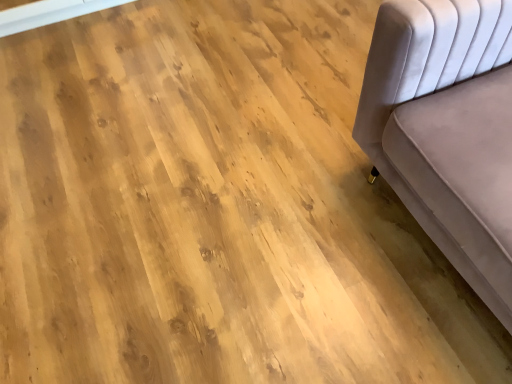
This screenshot has width=512, height=384. In order to click on suede-like gray couch at right in this screenshot , I will do `click(447, 131)`.

Describe the element at coordinates (447, 131) in the screenshot. The image size is (512, 384). I see `suede-like gray couch at right` at that location.

You are a GUI agent. You are given a task and a screenshot of the screen. Output one action in this format:
    pyautogui.click(x=<x>, y=<y>)
    Task: Click on the suede-like gray couch at right
    
    Given the screenshot: What is the action you would take?
    pyautogui.click(x=447, y=131)